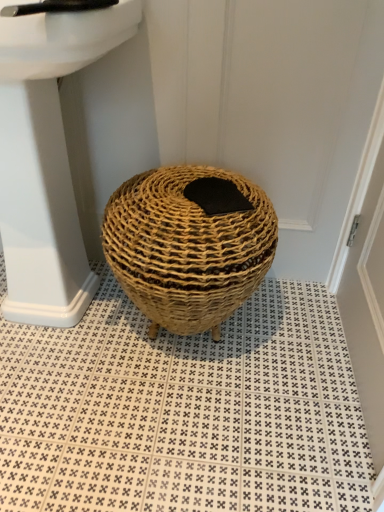
Question: From the image's perspective, is natural woven basket at center beneath black felt pad at center?

Choices:
 (A) yes
 (B) no

Answer: (A)

Question: Is natural woven basket at center placed right next to black felt pad at center?

Choices:
 (A) yes
 (B) no

Answer: (B)

Question: Is the position of natural woven basket at center less distant than that of black felt pad at center?

Choices:
 (A) yes
 (B) no

Answer: (A)

Question: Is natural woven basket at center positioned behind black felt pad at center?

Choices:
 (A) yes
 (B) no

Answer: (B)

Question: From a real-world perspective, is natural woven basket at center below black felt pad at center?

Choices:
 (A) yes
 (B) no

Answer: (A)

Question: In the image, is natural woven basket at center on the left side or the right side of natural woven basket at center?

Choices:
 (A) left
 (B) right

Answer: (B)

Question: Relative to natural woven basket at center, is natural woven basket at center in front or behind?

Choices:
 (A) front
 (B) behind

Answer: (B)

Question: Considering the positions of point (140, 237) and point (4, 426), is point (140, 237) closer or farther from the camera than point (4, 426)?

Choices:
 (A) farther
 (B) closer

Answer: (B)

Question: From a real-world perspective, is natural woven basket at center physically located above or below natural woven basket at center?

Choices:
 (A) above
 (B) below

Answer: (A)

Question: Is natural woven basket at center in front of or behind black felt pad at center in the image?

Choices:
 (A) front
 (B) behind

Answer: (A)

Question: From the image's perspective, is natural woven basket at center above or below black felt pad at center?

Choices:
 (A) below
 (B) above

Answer: (A)

Question: Looking at their shapes, would you say natural woven basket at center is wider or thinner than black felt pad at center?

Choices:
 (A) thin
 (B) wide

Answer: (B)

Question: Visually, is natural woven basket at center positioned to the left or to the right of black felt pad at center?

Choices:
 (A) right
 (B) left

Answer: (B)

Question: Does point (44, 4) appear closer or farther from the camera than point (39, 222)?

Choices:
 (A) closer
 (B) farther

Answer: (A)

Question: Is black plastic faucet at upper left bigger or smaller than white glossy sink at upper left?

Choices:
 (A) small
 (B) big

Answer: (A)